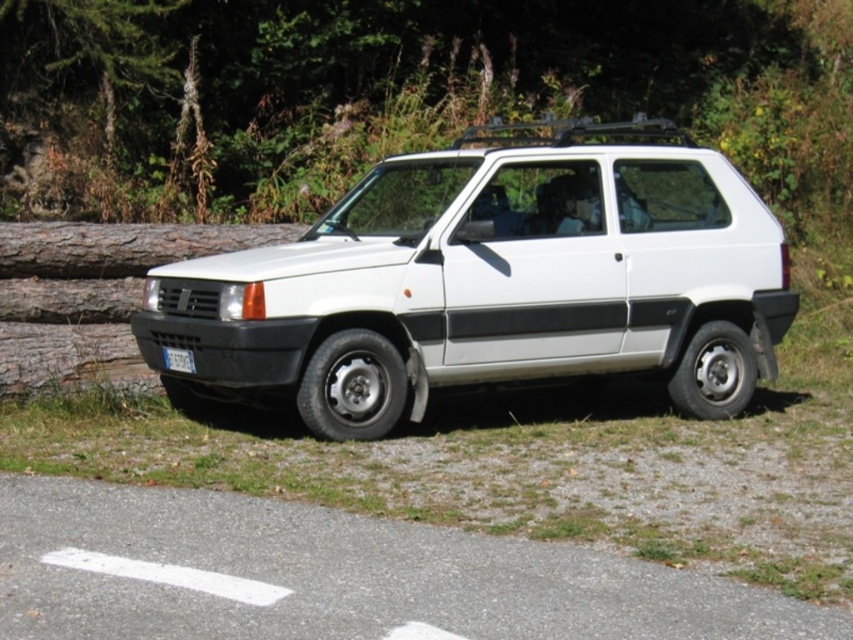
You are a delivery person trying to park a white matte suv at center in a tight space. There is a white plastic license plate at lower left nearby. Considering their sizes, can the SUV fit without hitting the license plate?

The white matte suv at center is larger than the white plastic license plate at lower left, so it can fit without hitting the license plate as long as proper spacing is maintained between them.